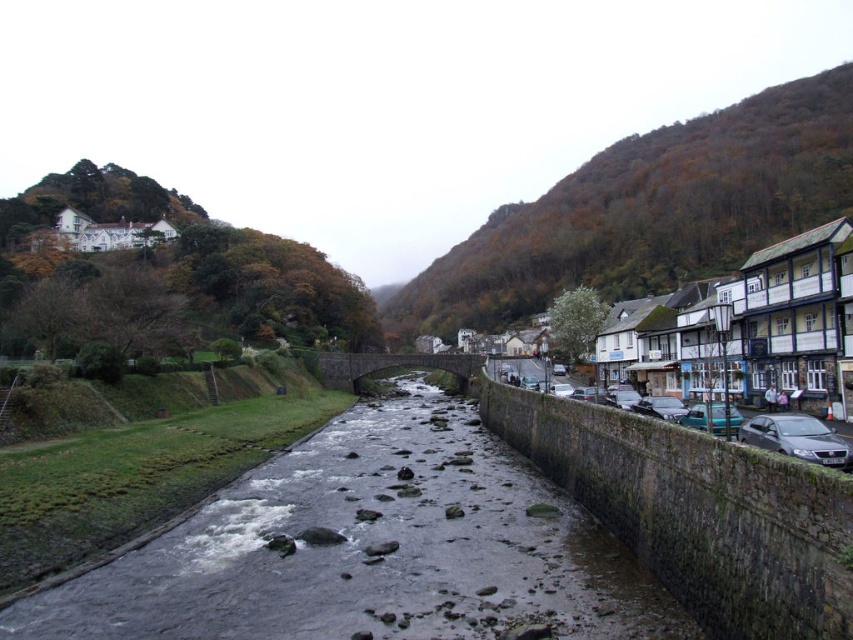
You are a tourist standing at the white wooden house at upper left and want to cross to the stone embankment on the right. Is the smooth concrete river at center the best path to take?

The smooth concrete river at center is to the right of white wooden house at upper left, so it is the correct path to reach the stone embankment on the right.

You are standing at the center of the river in the image and want to walk to the green leafy hillside at upper right and the white wooden house at upper left. Which direction should you head first to reach the closer one?

The green leafy hillside at upper right is closer to you than the white wooden house at upper left, so you should head towards the green leafy hillside at upper right first.